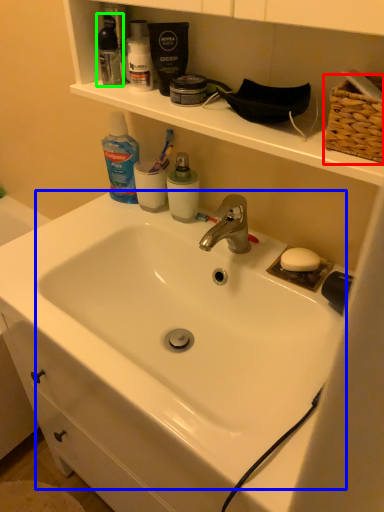
Question: Based on their relative distances, which object is nearer to basket (highlighted by a red box)? Choose from sink (highlighted by a blue box) and mouthwash (highlighted by a green box).

Choices:
 (A) sink
 (B) mouthwash

Answer: (A)